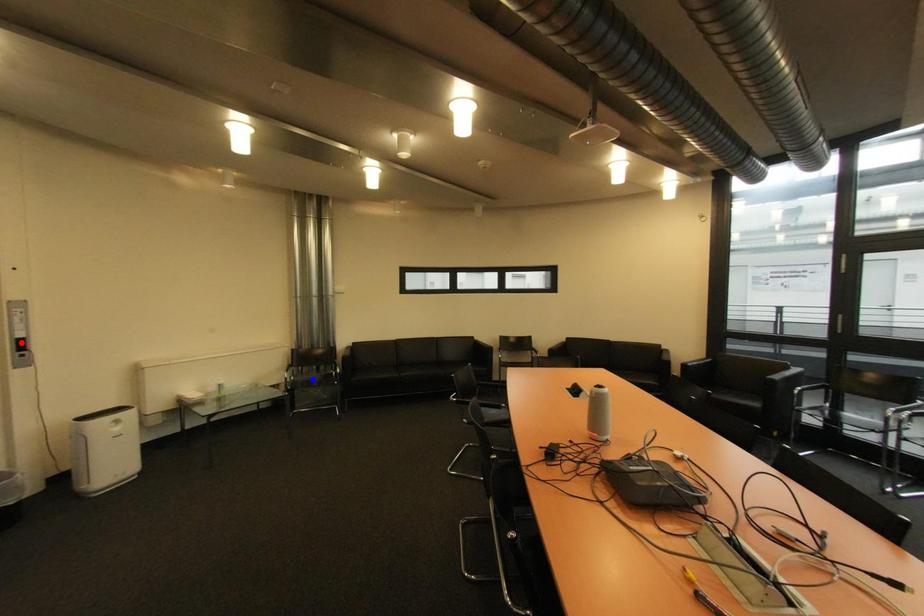
Question: Two points are marked on the image. Which point is closer to the camera?

Choices:
 (A) Blue point is closer.
 (B) Red point is closer.

Answer: (B)